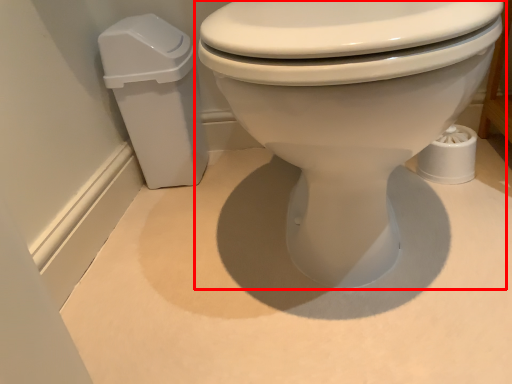
Question: From the image's perspective, where is toilet (annotated by the red box) located relative to porcelain?

Choices:
 (A) below
 (B) above

Answer: (A)